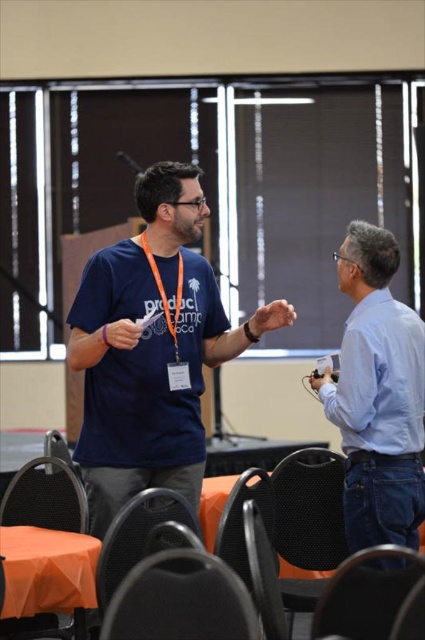
Question: Which is farther from the orange fabric table at lower left?

Choices:
 (A) transparent glass projection screen at upper center
 (B) matte blue t-shirt at center
 (C) light blue shirt at right

Answer: (A)

Question: Which object is closer to the camera taking this photo?

Choices:
 (A) orange fabric table at lower left
 (B) transparent glass projection screen at upper center
 (C) matte blue t-shirt at center
 (D) light blue shirt at right

Answer: (A)

Question: Which point appears farthest from the camera in this image?

Choices:
 (A) coord(51,237)
 (B) coord(360,339)
 (C) coord(150,220)
 (D) coord(71,579)

Answer: (A)

Question: Is transparent glass projection screen at upper center to the right of matte blue t-shirt at center from the viewer's perspective?

Choices:
 (A) yes
 (B) no

Answer: (A)

Question: Is transparent glass projection screen at upper center in front of matte blue t-shirt at center?

Choices:
 (A) no
 (B) yes

Answer: (A)

Question: Considering the relative positions of transparent glass projection screen at upper center and orange fabric table at lower left in the image provided, where is transparent glass projection screen at upper center located with respect to orange fabric table at lower left?

Choices:
 (A) above
 (B) below

Answer: (A)